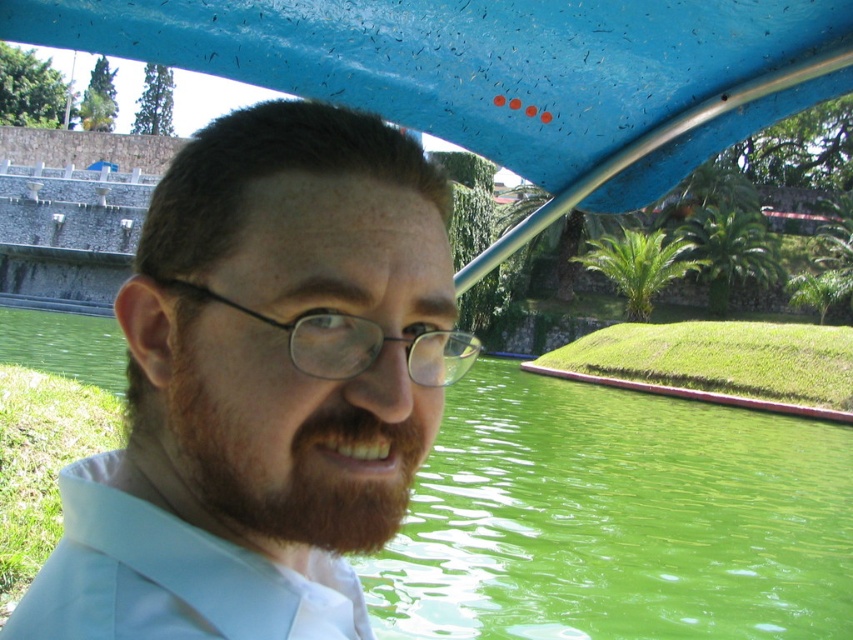
Can you confirm if matte blue shirt at center is positioned to the right of reddish-brown hair at center?

Incorrect, matte blue shirt at center is not on the right side of reddish-brown hair at center.

Can you confirm if matte blue shirt at center is shorter than reddish-brown hair at center?

Incorrect, matte blue shirt at center's height does not fall short of reddish-brown hair at center's.

Does point (152, 417) lie behind point (328, 420)?

Yes, point (152, 417) is behind point (328, 420).

Identify the location of matte blue shirt at center. (263, 387).

Where is `reddish-brown hair at center`? The image size is (853, 640). reddish-brown hair at center is located at coordinates [291, 438].

Is reddish-brown hair at center positioned in front of black plastic glasses at center?

That is True.

Between point (248, 387) and point (468, 356), which one is positioned behind?

Point (468, 356)

This screenshot has width=853, height=640. What are the coordinates of `reddish-brown hair at center` in the screenshot? It's located at (291, 438).

Is matte blue shirt at center to the left of green liquid water at center from the viewer's perspective?

In fact, matte blue shirt at center is to the right of green liquid water at center.

Does point (183, 429) come farther from viewer compared to point (814, 433)?

That is False.

Where is `matte blue shirt at center`? The image size is (853, 640). matte blue shirt at center is located at coordinates (263, 387).

Locate an element on the screen. This screenshot has width=853, height=640. matte blue shirt at center is located at coordinates point(263,387).